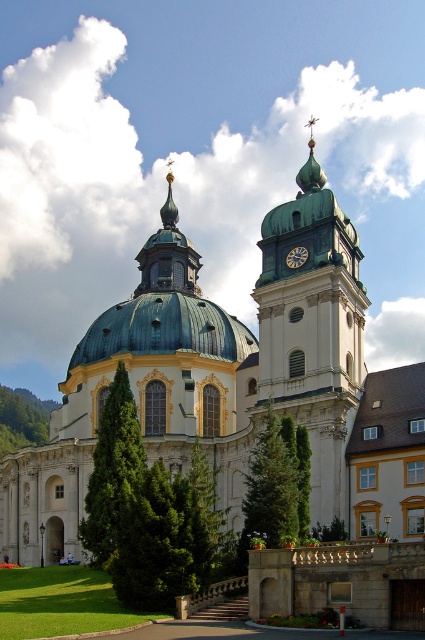
You are a maintenance worker who needs to reach both the green copper bell tower at center and the gold metallic clock at center with a ladder. If your ladder can only extend to 5 meters, can you place it once to reach both objects?

The green copper bell tower at center and gold metallic clock at center are 5.34 meters apart, so the ladder cannot span the distance between them in a single placement. You would need to move the ladder to reach both objects.

You are a tourist visiting the church and want to take a photo that includes both the green dome at center and the gold metallic clock at center. Based on their positions, which one should you focus on first to ensure both are in the frame?

The green dome at center is positioned over the gold metallic clock at center, so you should focus on the gold metallic clock at center first to ensure both are in the frame.